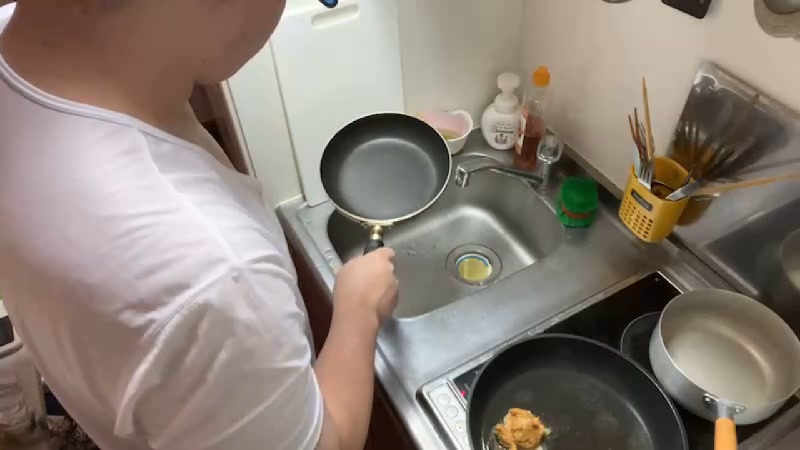
I want to click on drain, so click(478, 246).